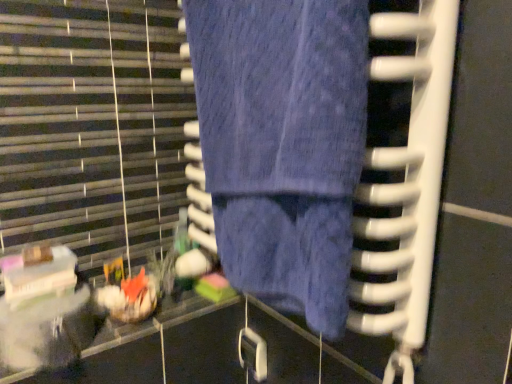
This screenshot has height=384, width=512. What do you see at coordinates (283, 144) in the screenshot? I see `blue cotton towel at center` at bounding box center [283, 144].

The height and width of the screenshot is (384, 512). In order to click on blue cotton towel at center in this screenshot , I will do `click(283, 144)`.

The height and width of the screenshot is (384, 512). In order to click on blue cotton towel at center in this screenshot , I will do `click(283, 144)`.